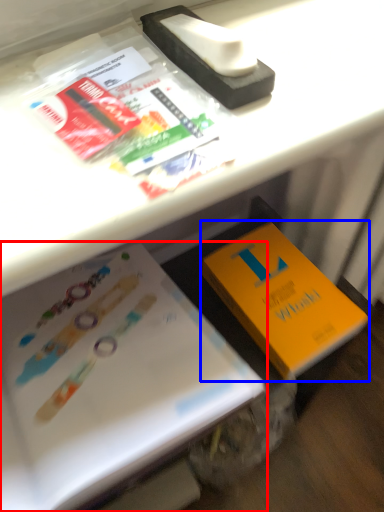
Question: Which object is further to the camera taking this photo, book (highlighted by a red box) or book (highlighted by a blue box)?

Choices:
 (A) book
 (B) book

Answer: (B)